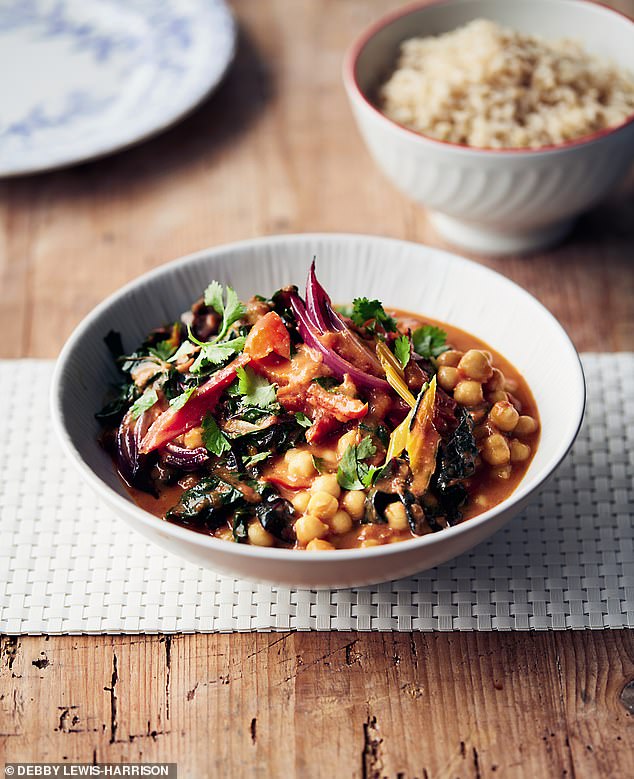
Image resolution: width=634 pixels, height=779 pixels. Find the location of `wooden table`. wooden table is located at coordinates (150, 717), (351, 707), (496, 705), (571, 710), (139, 237), (261, 146), (602, 249).